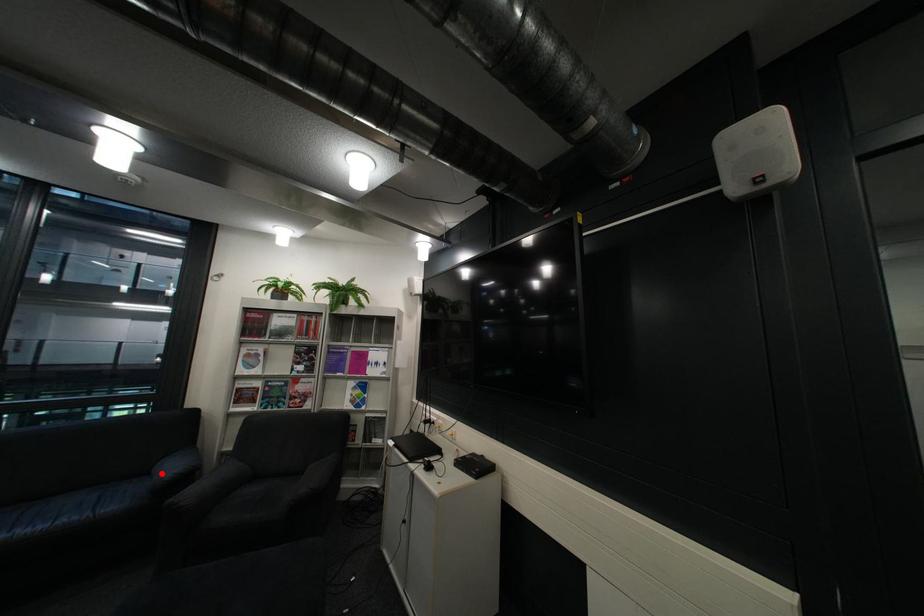
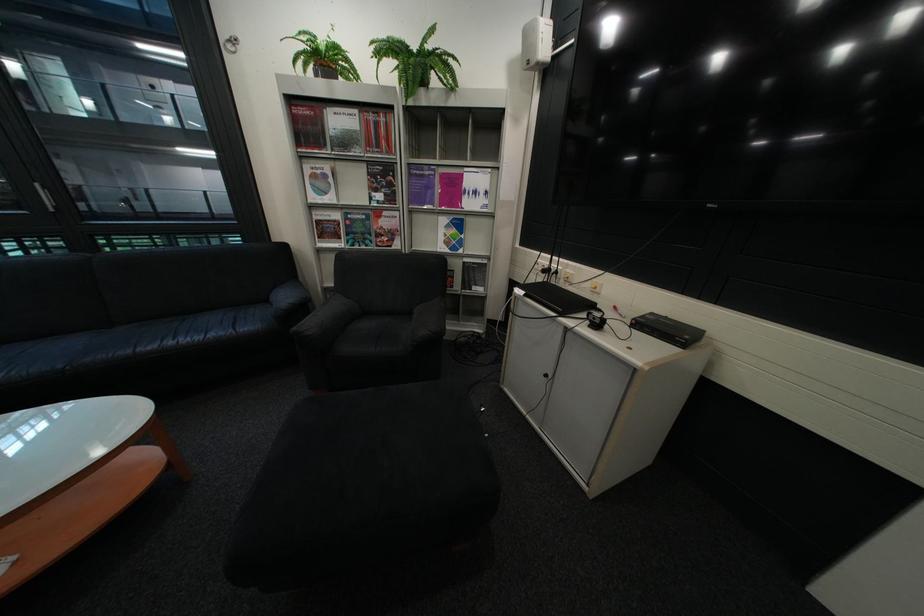
The point at the highlighted location is marked in the first image. Where is the corresponding point in the second image?

(282, 301)